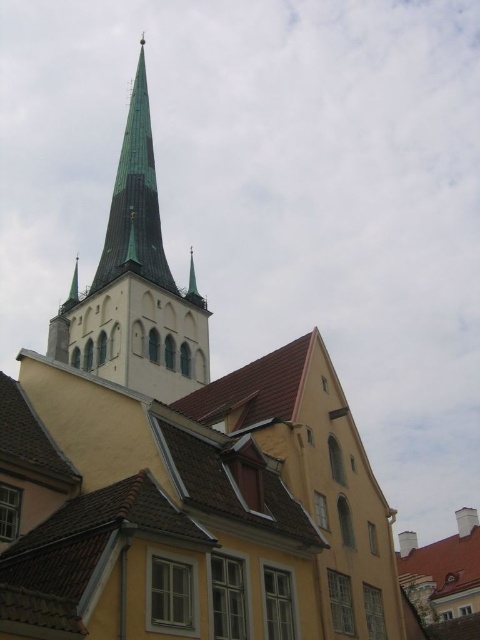
Does green glass spire at upper center appear on the right side of green copper spire at upper center?

Incorrect, green glass spire at upper center is not on the right side of green copper spire at upper center.

Where is `green glass spire at upper center`? The width and height of the screenshot is (480, 640). green glass spire at upper center is located at coordinates (135, 285).